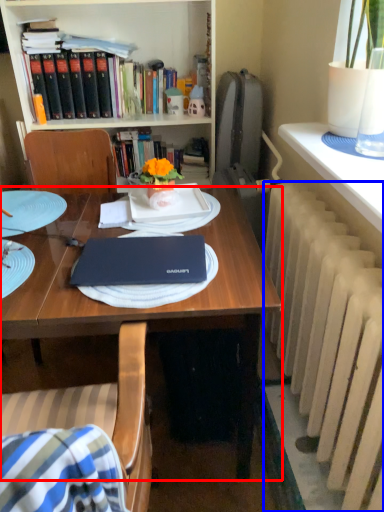
Question: Which object is closer to the camera taking this photo, desk (highlighted by a red box) or radiator (highlighted by a blue box)?

Choices:
 (A) desk
 (B) radiator

Answer: (B)